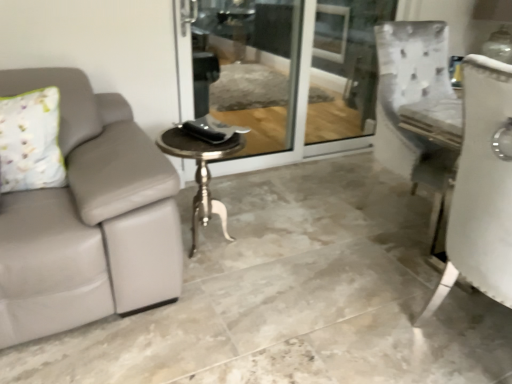
At what (x,y) coordinates should I click in order to perform the action: click on vacant location below clear glass screen door at center (from a real-world perspective). Please return your answer as a coordinate pair (x, y). Image resolution: width=512 pixels, height=384 pixels. Looking at the image, I should click on (281, 164).